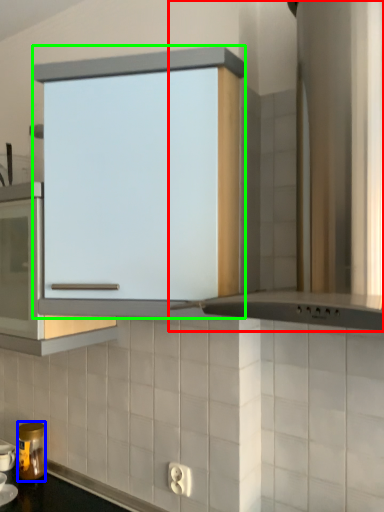
Question: Based on their relative distances, which object is nearer to home appliance (highlighted by a red box)? Choose from kitchen appliance (highlighted by a blue box) and cabinetry (highlighted by a green box).

Choices:
 (A) kitchen appliance
 (B) cabinetry

Answer: (B)